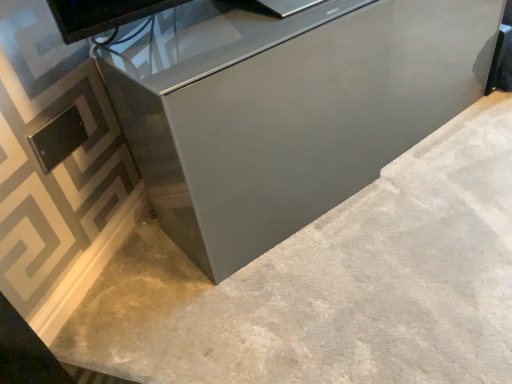
Question: Is gray polished concrete at center at the left side of satin gray cabinet at center?

Choices:
 (A) no
 (B) yes

Answer: (B)

Question: Can you confirm if gray polished concrete at center is thinner than satin gray cabinet at center?

Choices:
 (A) no
 (B) yes

Answer: (A)

Question: From the image's perspective, would you say gray polished concrete at center is positioned over satin gray cabinet at center?

Choices:
 (A) no
 (B) yes

Answer: (A)

Question: Is satin gray cabinet at center located within gray polished concrete at center?

Choices:
 (A) yes
 (B) no

Answer: (B)

Question: Considering the relative sizes of gray polished concrete at center and satin gray cabinet at center in the image provided, is gray polished concrete at center bigger than satin gray cabinet at center?

Choices:
 (A) yes
 (B) no

Answer: (B)

Question: Does gray polished concrete at center have a greater height compared to satin gray cabinet at center?

Choices:
 (A) no
 (B) yes

Answer: (A)

Question: Is satin gray cabinet at center far away from gray polished concrete at center?

Choices:
 (A) yes
 (B) no

Answer: (B)

Question: Is satin gray cabinet at center at the right side of gray polished concrete at center?

Choices:
 (A) no
 (B) yes

Answer: (B)

Question: Is the depth of satin gray cabinet at center greater than that of gray polished concrete at center?

Choices:
 (A) no
 (B) yes

Answer: (B)

Question: From the image's perspective, would you say satin gray cabinet at center is positioned over gray polished concrete at center?

Choices:
 (A) yes
 (B) no

Answer: (A)

Question: Considering the relative positions of satin gray cabinet at center and gray polished concrete at center in the image provided, is satin gray cabinet at center in front of gray polished concrete at center?

Choices:
 (A) no
 (B) yes

Answer: (A)

Question: Can you confirm if satin gray cabinet at center is wider than gray polished concrete at center?

Choices:
 (A) yes
 (B) no

Answer: (B)

Question: Is point pyautogui.click(x=358, y=228) closer or farther from the camera than point pyautogui.click(x=325, y=150)?

Choices:
 (A) farther
 (B) closer

Answer: (A)